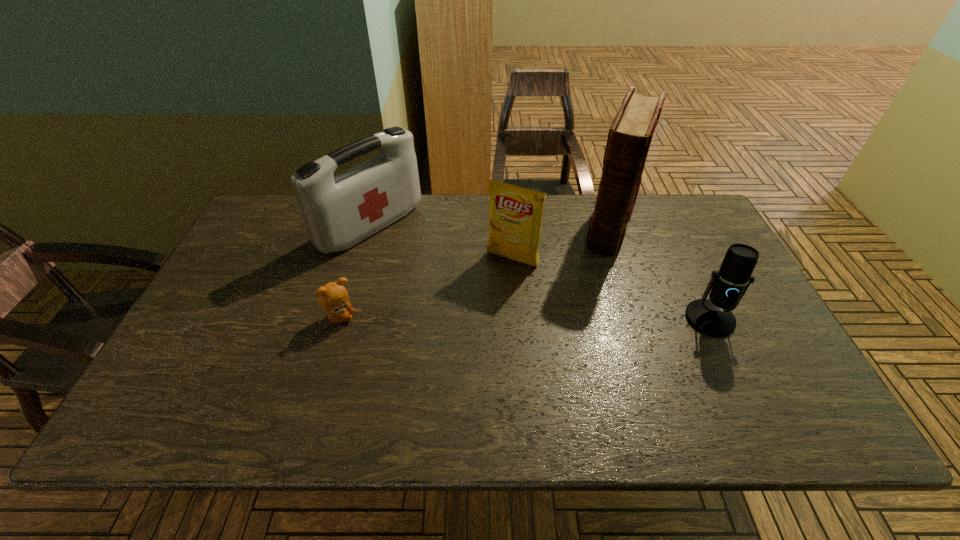
This screenshot has height=540, width=960. In order to click on free space that is in between the first-aid kit and the rightmost object in this screenshot , I will do `click(540, 273)`.

Identify the location of vacant region between the hardback book and the teddy bear. (475, 271).

Where is `vacant space that's between the rightmost object and the tallest object`? vacant space that's between the rightmost object and the tallest object is located at coordinates (660, 271).

Locate an element on the screen. The height and width of the screenshot is (540, 960). free space between the teddy bear and the third object from right to left is located at coordinates (425, 288).

In order to click on object that stands as the third closest to the microphone in this screenshot , I will do `click(338, 212)`.

This screenshot has width=960, height=540. Identify the location of object that is the closest to the second object from right to left. (515, 217).

Find the location of a particular element. Image resolution: width=960 pixels, height=540 pixels. free region that satisfies the following two spatial constraints: 1. on the back side of the hardback book; 2. on the left side of the crisp (potato chip) is located at coordinates (509, 224).